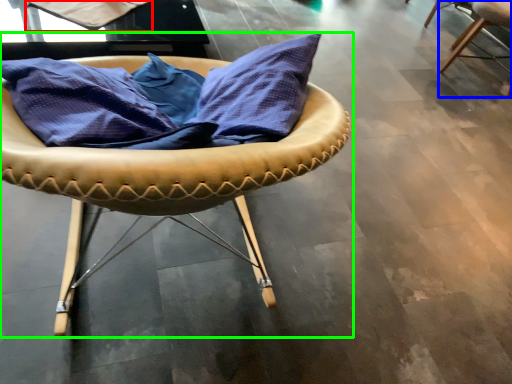
Question: Which object is positioned farthest from fabric (highlighted by a red box)? Select from chair (highlighted by a blue box) and chair (highlighted by a green box).

Choices:
 (A) chair
 (B) chair

Answer: (A)